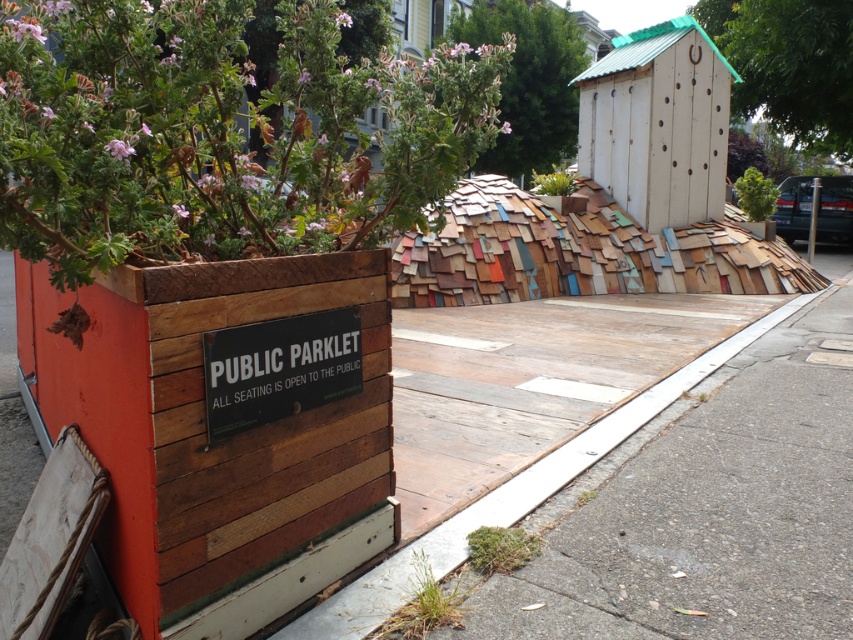
You are a city planner assessing the parklet design. You notice the green leafy plant at upper right and the pink wood flower at upper left. Which object is located higher up in the parklet structure?

The pink wood flower at upper left is positioned higher because the green leafy plant at upper right is located under it.

What is the purpose of the point labeled at coordinates (x=219, y=426)?

The point labeled at coordinates (x=219, y=426) indicates the wooden planter at left.